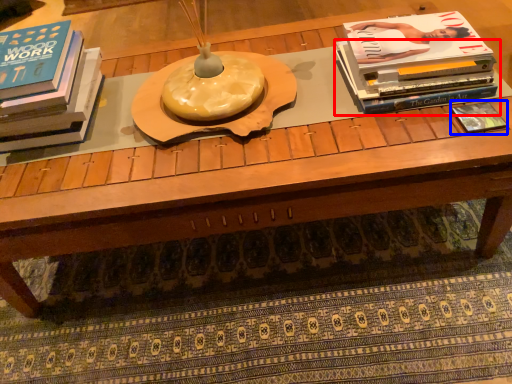
Question: Which object appears farthest to the camera in this image, book (highlighted by a red box) or book (highlighted by a blue box)?

Choices:
 (A) book
 (B) book

Answer: (A)